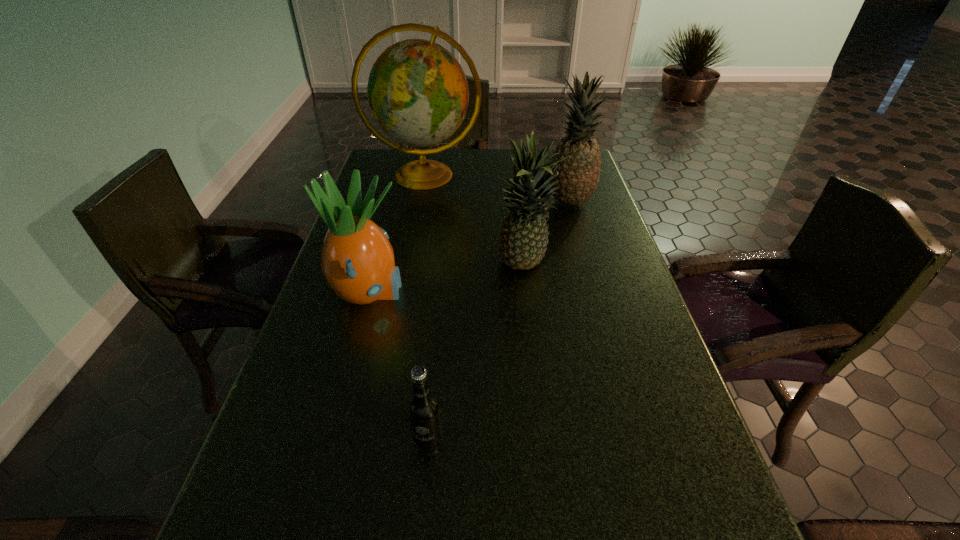
Identify the location of the tallest object. The image size is (960, 540). (418, 93).

At what (x,y) coordinates should I click in order to perform the action: click on the farthest pineapple. Please return your answer as a coordinate pair (x, y). The width and height of the screenshot is (960, 540). Looking at the image, I should click on (578, 176).

Where is `the rightmost object`? The image size is (960, 540). the rightmost object is located at coordinates (578, 176).

At what (x,y) coordinates should I click in order to perform the action: click on the second pineapple from right to left. Please return your answer as a coordinate pair (x, y). Image resolution: width=960 pixels, height=540 pixels. Looking at the image, I should click on (523, 239).

This screenshot has height=540, width=960. I want to click on the fourth tallest object, so click(x=357, y=260).

In order to click on the shortest pineapple in this screenshot , I will do `click(357, 260)`.

Where is `the nearest object`? This screenshot has height=540, width=960. the nearest object is located at coordinates (423, 408).

I want to click on root beer, so click(423, 408).

Where is `free spot located on the front of the tallest object`? free spot located on the front of the tallest object is located at coordinates (410, 249).

Locate an element on the screen. This screenshot has width=960, height=540. vacant region located on the front of the farthest pineapple is located at coordinates (594, 285).